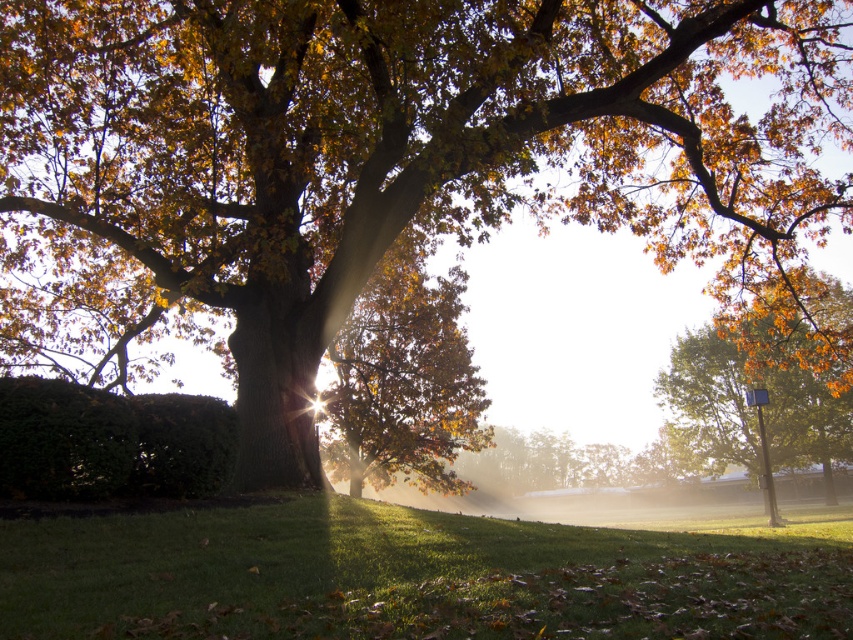
Is green grassy at lower center further to camera compared to golden brown leaves at center?

No, green grassy at lower center is closer to the viewer.

Who is positioned more to the left, green grassy at lower center or golden brown leaves at center?

green grassy at lower center is more to the left.

Locate an element on the screen. Image resolution: width=853 pixels, height=640 pixels. green grassy at lower center is located at coordinates (405, 577).

The image size is (853, 640). What do you see at coordinates (405, 577) in the screenshot? I see `green grassy at lower center` at bounding box center [405, 577].

The width and height of the screenshot is (853, 640). In order to click on green grassy at lower center in this screenshot , I will do `click(405, 577)`.

The width and height of the screenshot is (853, 640). In order to click on green grassy at lower center in this screenshot , I will do `click(405, 577)`.

Can you confirm if green grassy at lower center is positioned below green leafy hedge at lower left?

Correct, green grassy at lower center is located below green leafy hedge at lower left.

Can you confirm if green grassy at lower center is smaller than green leafy hedge at lower left?

→ No, green grassy at lower center is not smaller than green leafy hedge at lower left.

Where is `green grassy at lower center`? The height and width of the screenshot is (640, 853). green grassy at lower center is located at coordinates (405, 577).